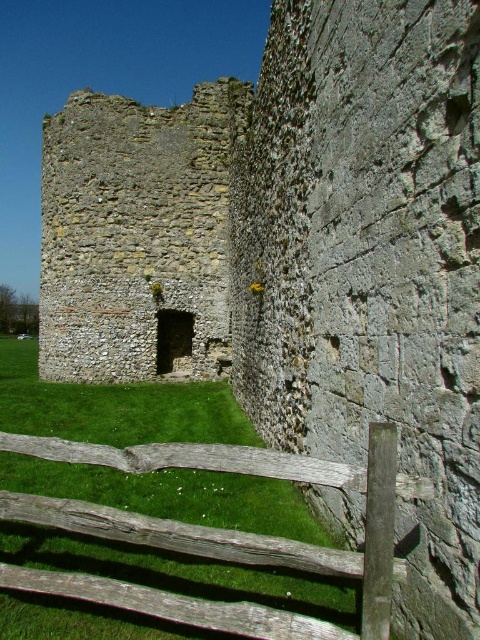
You are an architect assessing the structural integrity of the rusty stone ruins at center and the weathered wood fence at lower center. Which of these two structures has a greater width?

The rusty stone ruins at center has a greater width than the weathered wood fence at lower center, as stated in the description that the rusty stone ruins at center surpasses the weathered wood fence at lower center in width.

You are standing at the base of the historic stone structure and want to take a photo. You notice two points marked in the scene. Which point, point (203,355) or point (264,612), is closer to your camera lens?

Point (203,355) is further to the camera than point (264,612), so the point closer to the camera lens is point (264,612).

You are standing at the point marked by coordinates [137,236] in the image. Based on the scene description, what significant structure are you likely standing near?

You are standing near the rusty stone ruins at center, as the coordinates point to that location.